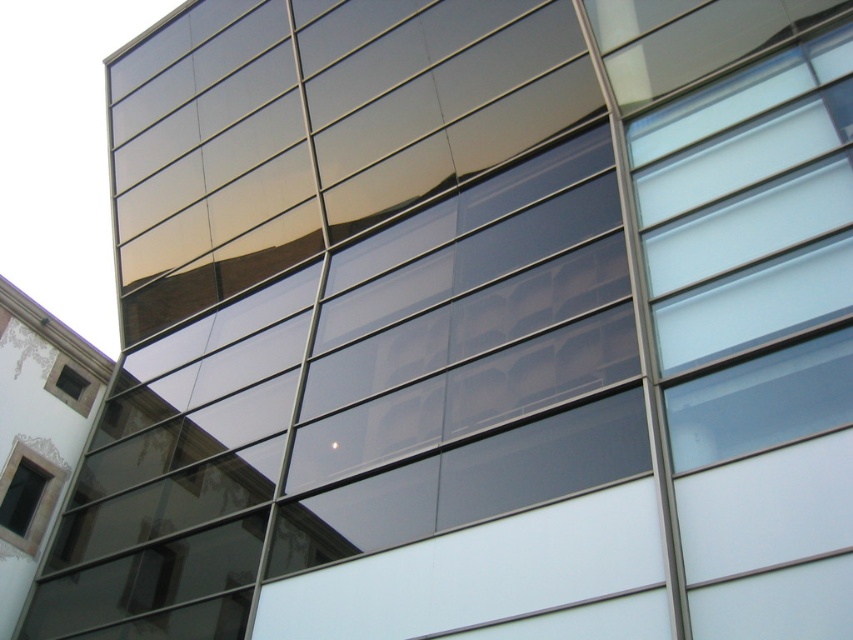
You are an architect examining the building facade. You notice two windows at the lower left corner. Which one is positioned more to the left between the matte glass window at lower left and the matte black window at lower left?

The matte glass window at lower left is positioned more to the left compared to the matte black window at lower left as per the description provided.

You are standing in front of the modern building and want to touch the nearest window. Which one should you reach for between the matte glass window at lower left and the matte black window at lower left?

The matte glass window at lower left is closer to the viewer than the matte black window at lower left, so you should reach for the matte glass window at lower left.